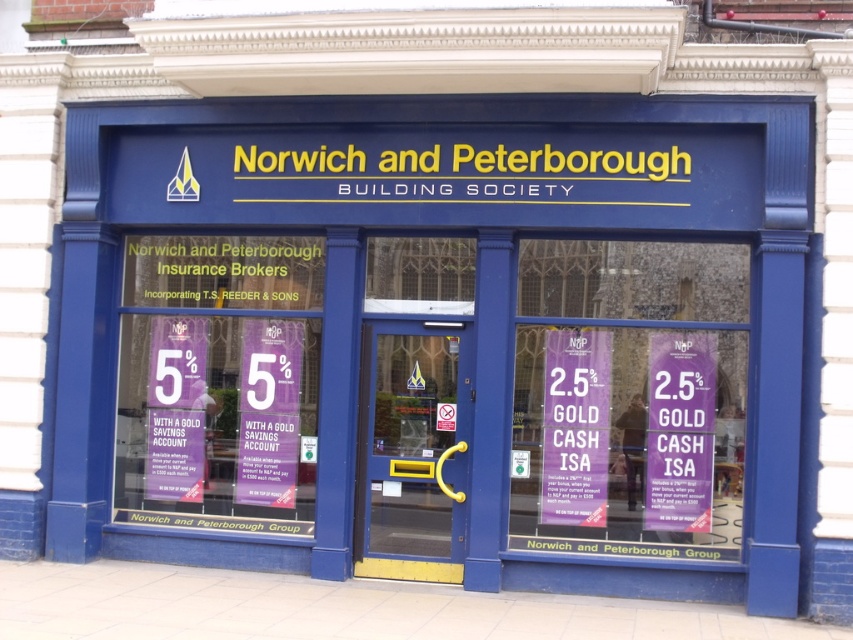
Is purple paper at center below purple paper at left?

Correct, purple paper at center is located below purple paper at left.

Does purple paper at center appear over purple paper at left?

Incorrect, purple paper at center is not positioned above purple paper at left.

Between point (645, 356) and point (254, 365), which one is positioned behind?

The point (254, 365) is more distant.

The height and width of the screenshot is (640, 853). In order to click on purple paper at center in this screenshot , I will do `click(630, 397)`.